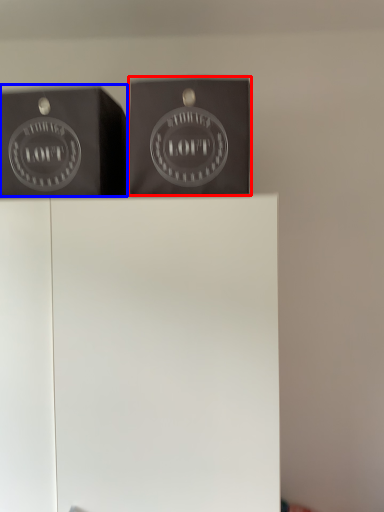
Question: Among these objects, which one is farthest to the camera, package (highlighted by a red box) or writing (highlighted by a blue box)?

Choices:
 (A) package
 (B) writing

Answer: (B)